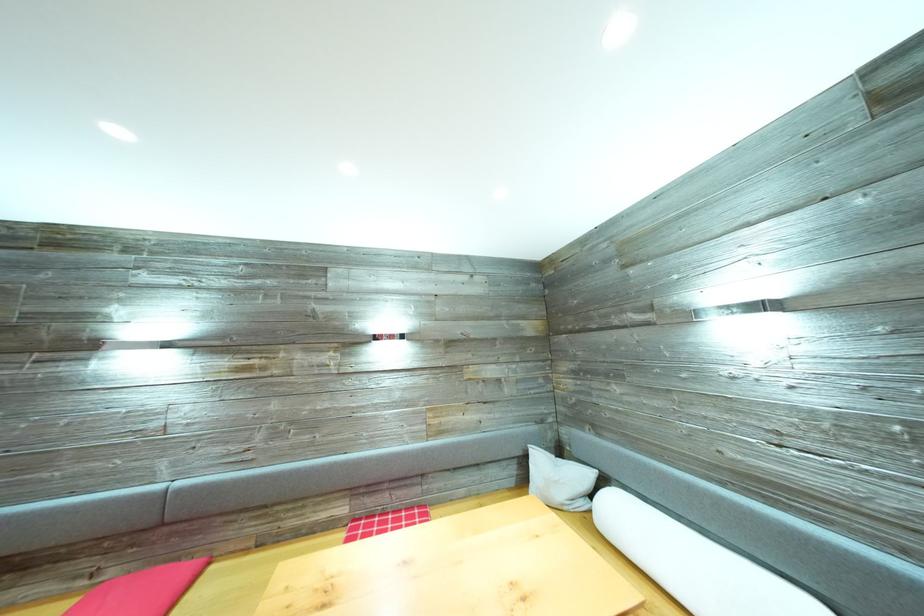
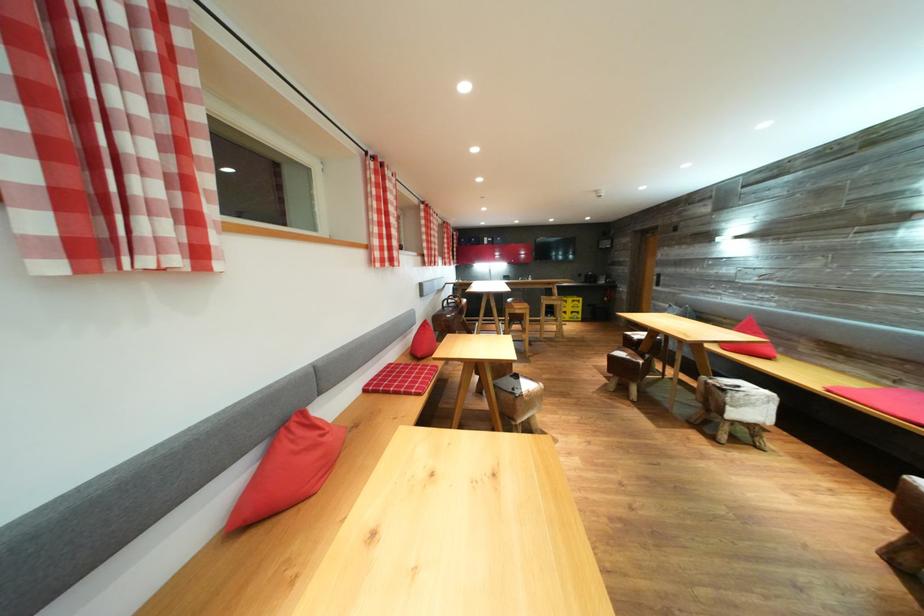
In the second image, find the point that corresponds to the point at 91,588 in the first image.

(895, 389)